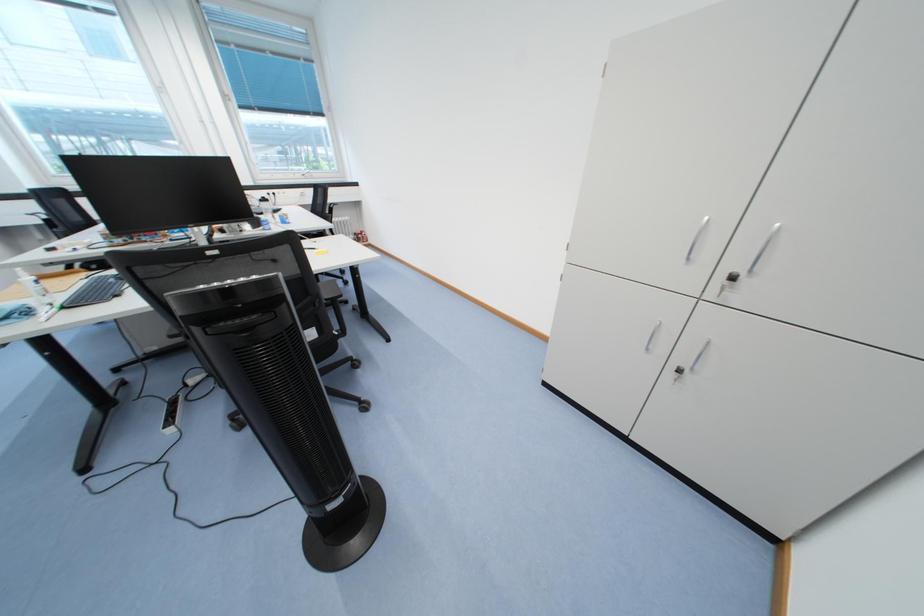
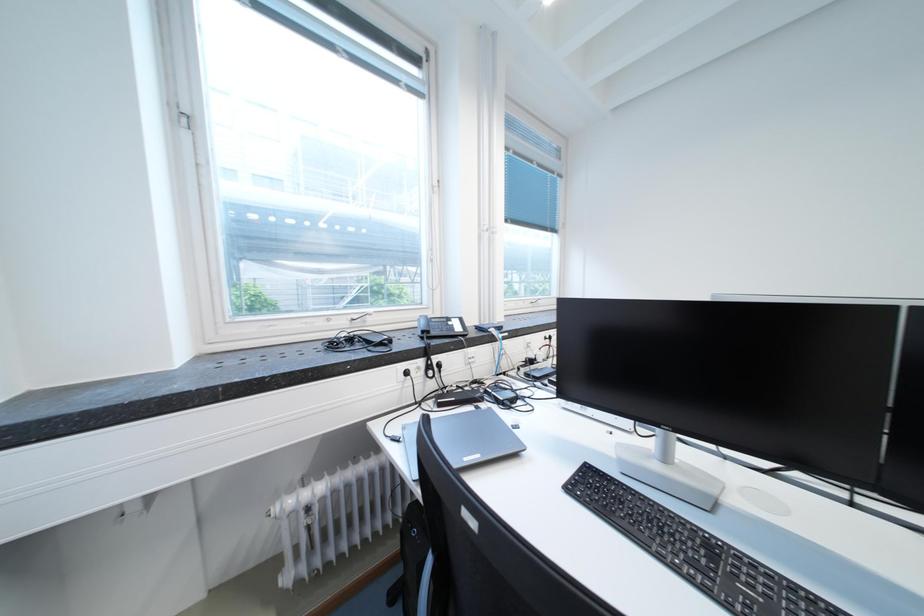
Looking at this image, which direction would the cameraman need to move to produce the second image?

The cameraman moved toward left, forward.